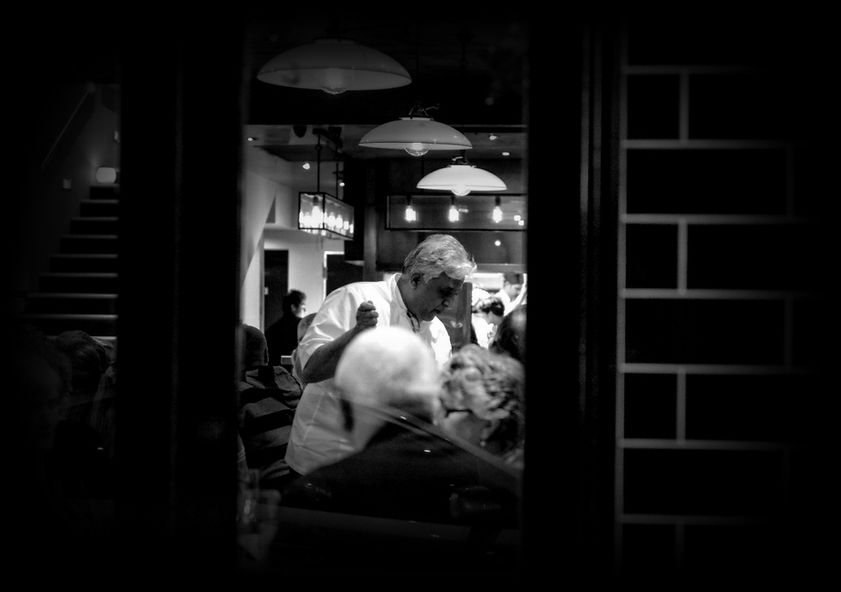
Identify the location of stairs. This screenshot has height=592, width=841. (91, 287).